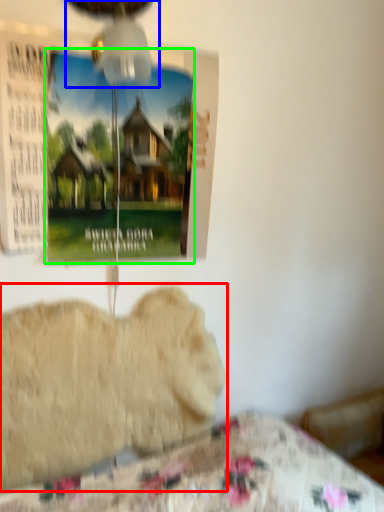
Question: Which is nearer to the animal (highlighted by a red box)? mechanical fan (highlighted by a blue box) or poster page (highlighted by a green box).

Choices:
 (A) mechanical fan
 (B) poster page

Answer: (B)